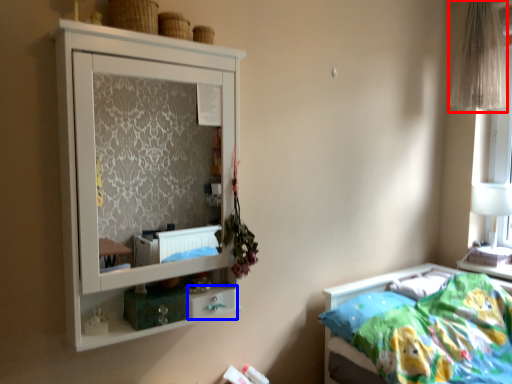
Question: Which object is further to the camera taking this photo, curtain (highlighted by a red box) or drawer (highlighted by a blue box)?

Choices:
 (A) curtain
 (B) drawer

Answer: (A)